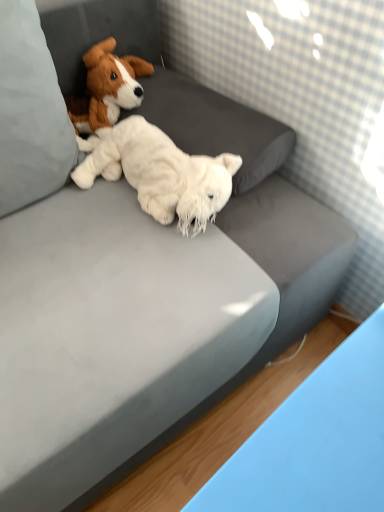
Question: Are white soft pillow at upper left and white fluffy stuffed animal at center, which ranks as the 1th dog in bottom-to-top order, making contact?

Choices:
 (A) yes
 (B) no

Answer: (B)

Question: Is white soft pillow at upper left oriented towards white fluffy stuffed animal at center, the second dog when ordered from top to bottom?

Choices:
 (A) no
 (B) yes

Answer: (A)

Question: Does white soft pillow at upper left lie in front of white fluffy stuffed animal at center, the second dog when ordered from top to bottom?

Choices:
 (A) yes
 (B) no

Answer: (A)

Question: Does white soft pillow at upper left have a smaller size compared to white fluffy stuffed animal at center, the second dog when ordered from top to bottom?

Choices:
 (A) yes
 (B) no

Answer: (B)

Question: From a real-world perspective, is white soft pillow at upper left located higher than white fluffy stuffed animal at center, the second dog when ordered from top to bottom?

Choices:
 (A) yes
 (B) no

Answer: (A)

Question: Is white soft pillow at upper left not within white fluffy stuffed animal at center, the second dog when ordered from top to bottom?

Choices:
 (A) no
 (B) yes

Answer: (B)

Question: Is brown plush dog at upper left, placed as the 2th dog when sorted from bottom to top, surrounded by white soft pillow at upper left?

Choices:
 (A) no
 (B) yes

Answer: (A)

Question: Can you see white soft pillow at upper left touching brown plush dog at upper left, placed as the 2th dog when sorted from bottom to top?

Choices:
 (A) yes
 (B) no

Answer: (B)

Question: Is brown plush dog at upper left, acting as the first dog starting from the top, at the back of white soft pillow at upper left?

Choices:
 (A) no
 (B) yes

Answer: (A)

Question: Can you confirm if white soft pillow at upper left is taller than brown plush dog at upper left, placed as the 2th dog when sorted from bottom to top?

Choices:
 (A) yes
 (B) no

Answer: (A)

Question: Considering the relative positions of white soft pillow at upper left and brown plush dog at upper left, placed as the 2th dog when sorted from bottom to top, in the image provided, is white soft pillow at upper left to the left of brown plush dog at upper left, placed as the 2th dog when sorted from bottom to top, from the viewer's perspective?

Choices:
 (A) no
 (B) yes

Answer: (B)

Question: From the image's perspective, is white soft pillow at upper left located above brown plush dog at upper left, placed as the 2th dog when sorted from bottom to top?

Choices:
 (A) yes
 (B) no

Answer: (B)

Question: Is brown plush dog at upper left, acting as the first dog starting from the top, beside white soft pillow at upper left?

Choices:
 (A) no
 (B) yes

Answer: (A)